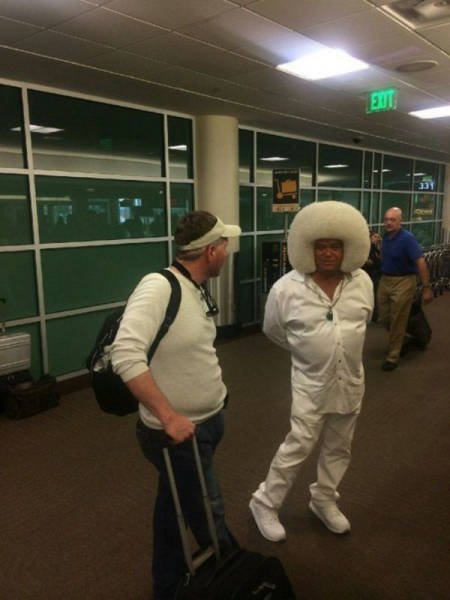
This screenshot has width=450, height=600. I want to click on windows, so click(61, 204), click(58, 276), click(108, 150), click(79, 346), click(270, 216), click(340, 161), click(424, 205).